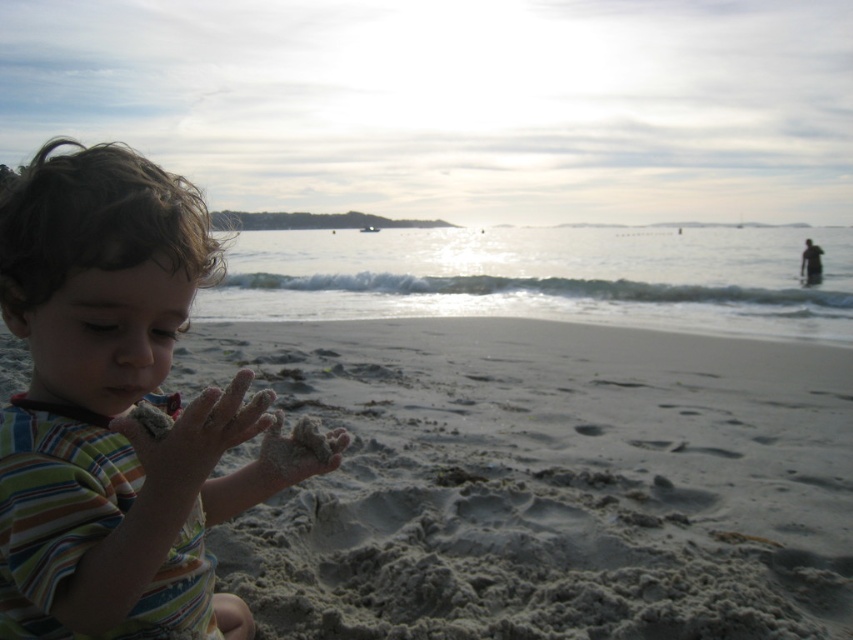
Looking at this image, you are a photographer trying to capture the child in the scene. The child has a sandy skin hand at lower left. Where is the sandy skin hand at lower left located in relation to the point marked at coordinates (196,438)?

The point at coordinates (196,438) marks the location of the sandy skin hand at lower left, so they are in the same position.